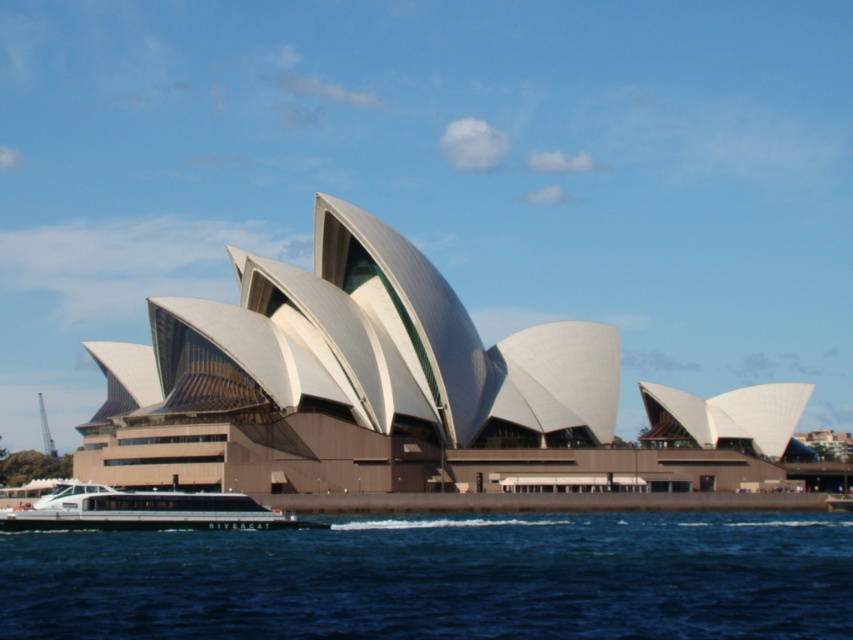
Question: Does white smooth building at center have a larger size compared to white glossy boat at lower left?

Choices:
 (A) yes
 (B) no

Answer: (A)

Question: Does white smooth building at center come in front of blue water at lower center?

Choices:
 (A) yes
 (B) no

Answer: (B)

Question: Which of these objects is positioned farthest from the blue water at lower center?

Choices:
 (A) white smooth building at center
 (B) white glossy boat at lower left

Answer: (A)

Question: Considering the real-world distances, which object is farthest from the white smooth building at center?

Choices:
 (A) white glossy boat at lower left
 (B) blue water at lower center

Answer: (B)

Question: Can you confirm if white smooth building at center is smaller than white glossy boat at lower left?

Choices:
 (A) yes
 (B) no

Answer: (B)

Question: Among these objects, which one is nearest to the camera?

Choices:
 (A) white glossy boat at lower left
 (B) white smooth building at center

Answer: (A)